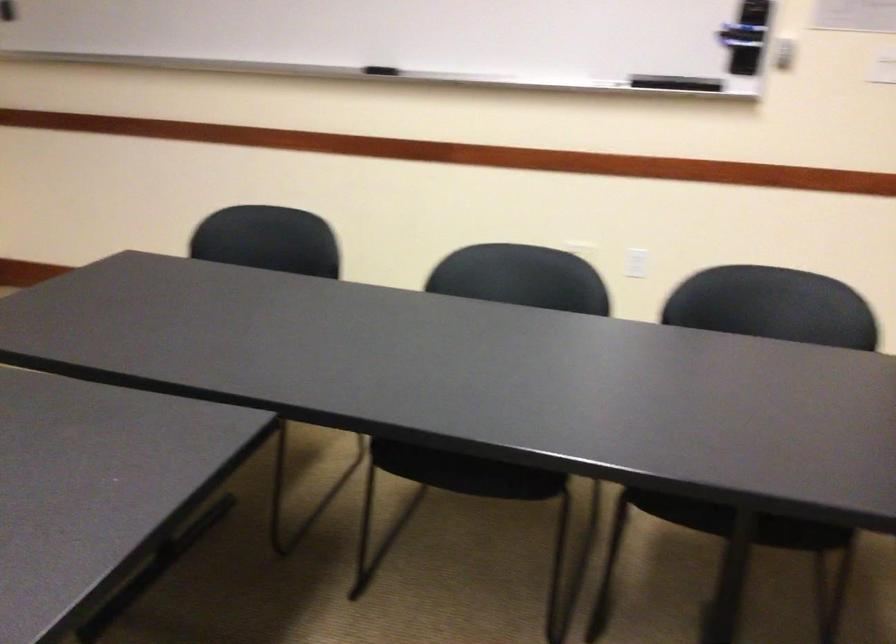
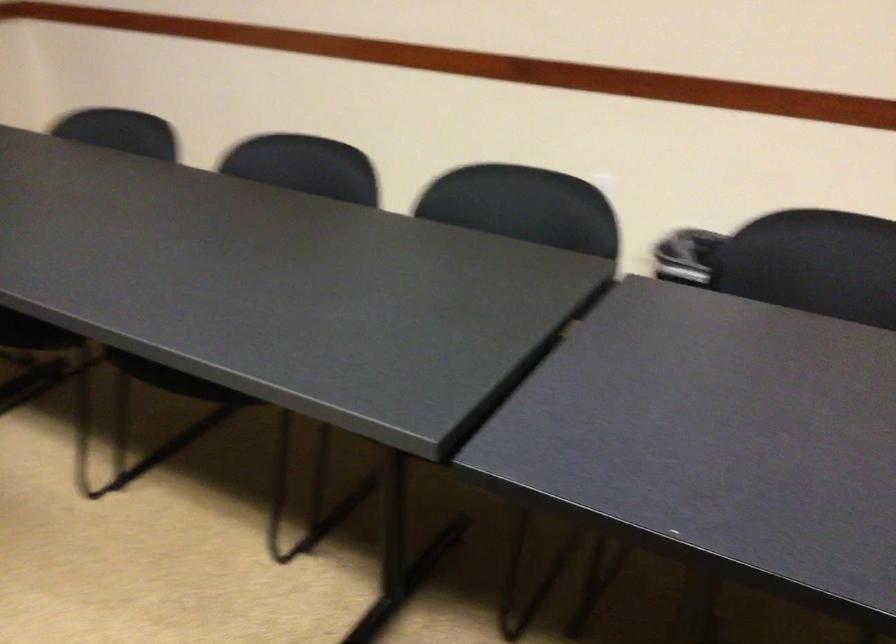
The images are taken continuously from a first-person perspective. In which direction is your viewpoint rotating?

The rotation direction of the camera is right-down.